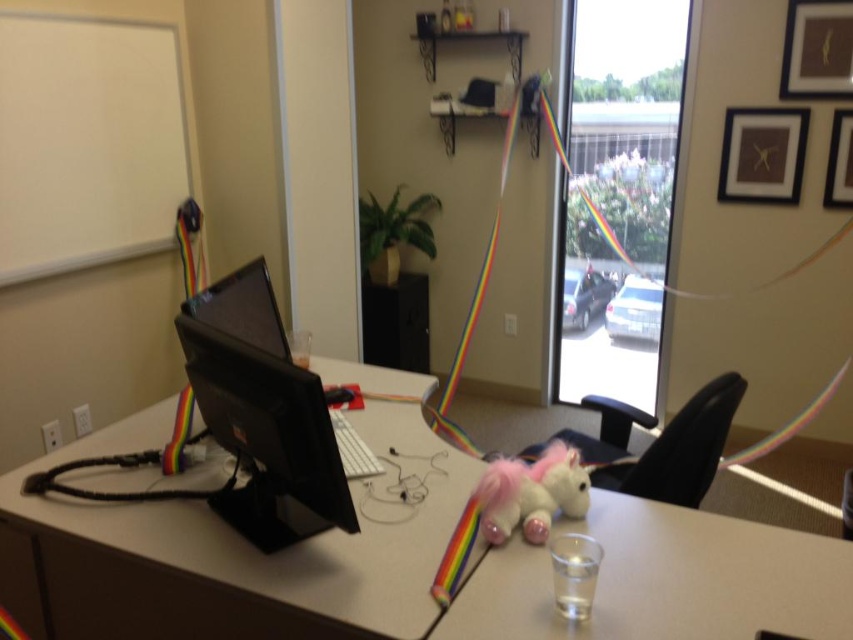
Looking at this image, which of these two, matte black monitor at center or plush pink unicorn at center, stands shorter?

Standing shorter between the two is plush pink unicorn at center.

Who is more forward, (425, 568) or (505, 528)?

Point (425, 568) is more forward.

The image size is (853, 640). Find the location of `matte black monitor at center`. matte black monitor at center is located at coordinates (401, 561).

At what (x,y) coordinates should I click in order to perform the action: click on matte black monitor at center. Please return your answer as a coordinate pair (x, y). The width and height of the screenshot is (853, 640). Looking at the image, I should click on (401, 561).

Based on the photo, is matte black monitor at center smaller than black glossy monitor at center?

Actually, matte black monitor at center might be larger than black glossy monitor at center.

Which is more to the left, matte black monitor at center or black glossy monitor at center?

black glossy monitor at center

Which is behind, point (97, 545) or point (340, 465)?

Positioned behind is point (97, 545).

This screenshot has height=640, width=853. I want to click on matte black monitor at center, so click(x=401, y=561).

Who is lower down, black glossy monitor at center or plush pink unicorn at center?

plush pink unicorn at center

Which is more to the right, black glossy monitor at center or plush pink unicorn at center?

Positioned to the right is plush pink unicorn at center.

You are a GUI agent. You are given a task and a screenshot of the screen. Output one action in this format:
    pyautogui.click(x=<x>, y=<y>)
    Task: Click on the black glossy monitor at center
    
    Given the screenshot: What is the action you would take?
    pyautogui.click(x=267, y=438)

At what (x,y) coordinates should I click in order to perform the action: click on black glossy monitor at center. Please return your answer as a coordinate pair (x, y). Image resolution: width=853 pixels, height=640 pixels. Looking at the image, I should click on (267, 438).